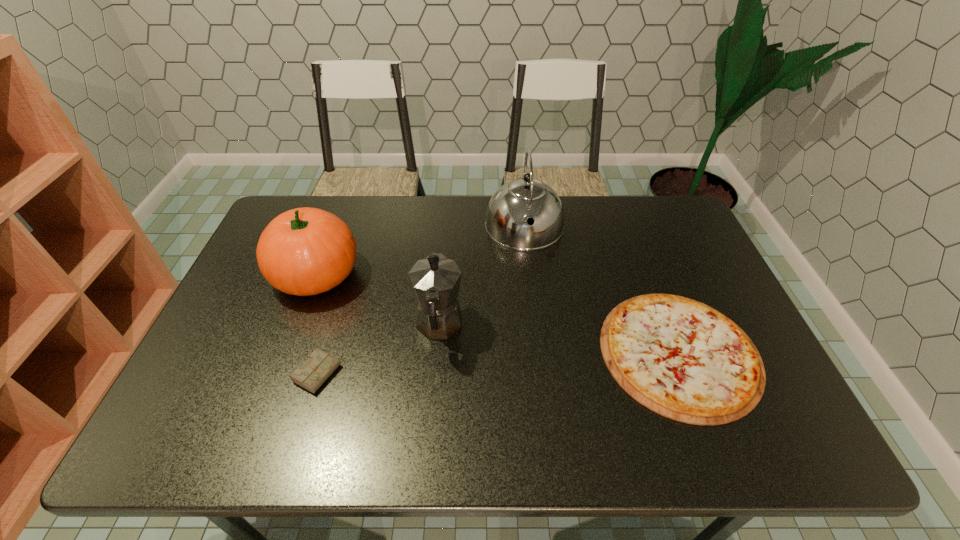
In order to click on object that is the fourth nearest to the third object from right to left in this screenshot , I will do 680,358.

You are a GUI agent. You are given a task and a screenshot of the screen. Output one action in this format:
    pyautogui.click(x=<x>, y=<y>)
    Task: Click on the closest object to the fourth tallest object
    
    Given the screenshot: What is the action you would take?
    pyautogui.click(x=305, y=251)

The width and height of the screenshot is (960, 540). I want to click on free location that satisfies the following two spatial constraints: 1. on the back side of the diary; 2. on the right side of the shortest object, so click(324, 353).

What are the coordinates of `free location that satisfies the following two spatial constraints: 1. on the back side of the shortest object; 2. on the left side of the fourth tallest object` in the screenshot? It's located at tap(324, 353).